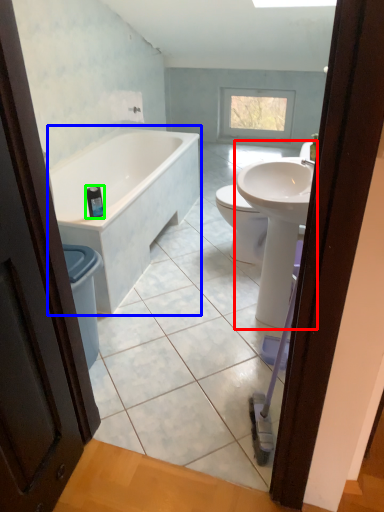
Question: Which is farther away from sink (highlighted by a red box)? bathtub (highlighted by a blue box) or toiletry (highlighted by a green box)?

Choices:
 (A) bathtub
 (B) toiletry

Answer: (A)